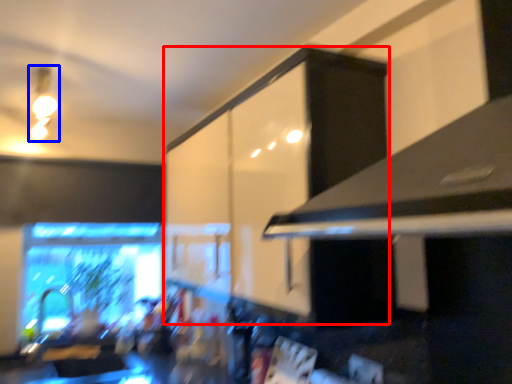
Question: Which point is further to the camera, cabinetry (highlighted by a red box) or light fixture (highlighted by a blue box)?

Choices:
 (A) cabinetry
 (B) light fixture

Answer: (B)